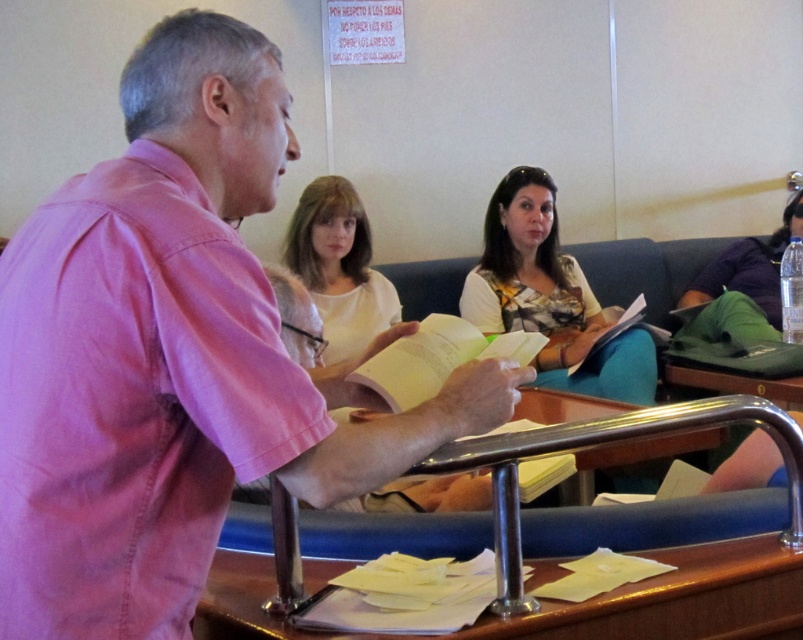
Describe the element at coordinates (549, 296) in the screenshot. I see `printed fabric blouse at center` at that location.

Based on the photo, is printed fabric blouse at center taller than white matte shirt at center?

Indeed, printed fabric blouse at center has a greater height compared to white matte shirt at center.

Who is more forward, [622,380] or [290,253]?

Positioned in front is point [622,380].

Find the location of a particular element. This screenshot has width=803, height=640. printed fabric blouse at center is located at coordinates (549, 296).

Can you confirm if printed fabric blouse at center is wider than matte purple shirt at upper right?

In fact, printed fabric blouse at center might be narrower than matte purple shirt at upper right.

Who is shorter, printed fabric blouse at center or matte purple shirt at upper right?

With less height is matte purple shirt at upper right.

Image resolution: width=803 pixels, height=640 pixels. Find the location of `printed fabric blouse at center`. printed fabric blouse at center is located at coordinates (549, 296).

Find the location of a particular element. printed fabric blouse at center is located at coordinates (549, 296).

Does white matte shirt at center have a greater height compared to matte purple shirt at upper right?

Indeed, white matte shirt at center has a greater height compared to matte purple shirt at upper right.

Does white matte shirt at center have a lesser width compared to matte purple shirt at upper right?

Yes.

Does point (304, 189) come behind point (693, 307)?

No, (304, 189) is closer to viewer.

Locate an element on the screen. This screenshot has width=803, height=640. white matte shirt at center is located at coordinates (339, 266).